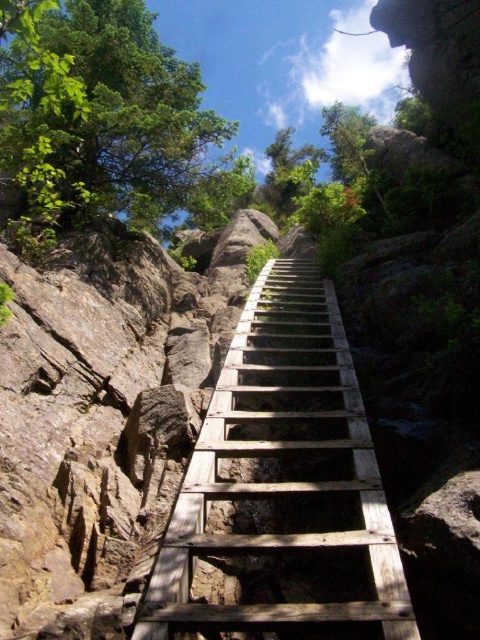
Does weathered wood ladder at center have a greater height compared to green leafy tree at upper left?

No.

Does weathered wood ladder at center have a lesser width compared to green leafy tree at upper left?

Yes.

Locate an element on the screen. weathered wood ladder at center is located at coordinates (282, 490).

Identify the location of weathered wood ladder at center. (282, 490).